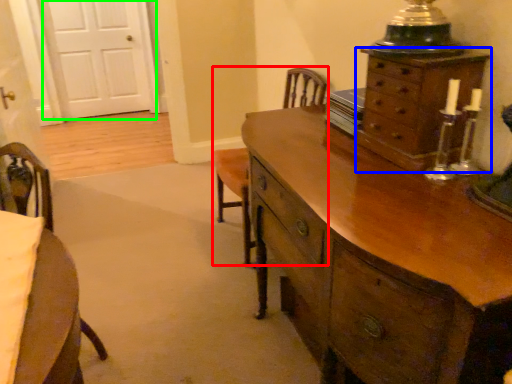
Question: Which object is positioned closest to armchair (highlighted by a red box)? Select from chest of drawers (highlighted by a blue box) and door (highlighted by a green box).

Choices:
 (A) chest of drawers
 (B) door

Answer: (A)